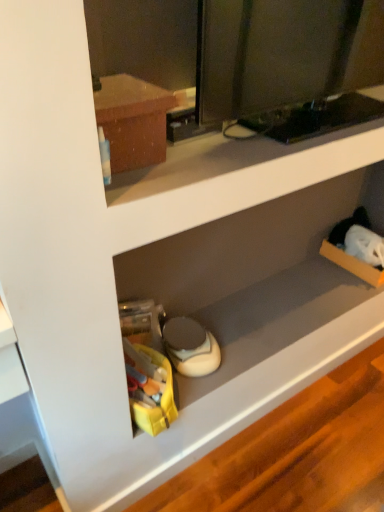
Question: Considering the relative sizes of white matte speaker at lower center and matte brown cabinet at upper left in the image provided, is white matte speaker at lower center wider than matte brown cabinet at upper left?

Choices:
 (A) no
 (B) yes

Answer: (B)

Question: Does white matte speaker at lower center have a smaller size compared to matte brown cabinet at upper left?

Choices:
 (A) yes
 (B) no

Answer: (B)

Question: Considering the relative positions of white matte speaker at lower center and matte brown cabinet at upper left in the image provided, is white matte speaker at lower center to the right of matte brown cabinet at upper left from the viewer's perspective?

Choices:
 (A) no
 (B) yes

Answer: (B)

Question: Is white matte speaker at lower center thinner than matte brown cabinet at upper left?

Choices:
 (A) no
 (B) yes

Answer: (A)

Question: Is white matte speaker at lower center further to the viewer compared to matte brown cabinet at upper left?

Choices:
 (A) yes
 (B) no

Answer: (A)

Question: Is white matte speaker at lower center positioned far away from matte brown cabinet at upper left?

Choices:
 (A) yes
 (B) no

Answer: (B)

Question: Is matte brown cabinet at upper left taller than white matte speaker at lower center?

Choices:
 (A) no
 (B) yes

Answer: (B)

Question: Is matte brown cabinet at upper left turned away from white matte speaker at lower center?

Choices:
 (A) yes
 (B) no

Answer: (B)

Question: From the image's perspective, is matte brown cabinet at upper left over white matte speaker at lower center?

Choices:
 (A) no
 (B) yes

Answer: (B)

Question: Is matte brown cabinet at upper left to the right of white matte speaker at lower center from the viewer's perspective?

Choices:
 (A) no
 (B) yes

Answer: (A)

Question: Considering the relative sizes of matte brown cabinet at upper left and white matte speaker at lower center in the image provided, is matte brown cabinet at upper left thinner than white matte speaker at lower center?

Choices:
 (A) no
 (B) yes

Answer: (B)

Question: Is matte brown cabinet at upper left aimed at white matte speaker at lower center?

Choices:
 (A) yes
 (B) no

Answer: (B)

Question: Is matte brown cabinet at upper left inside the boundaries of white matte speaker at lower center, or outside?

Choices:
 (A) outside
 (B) inside

Answer: (A)